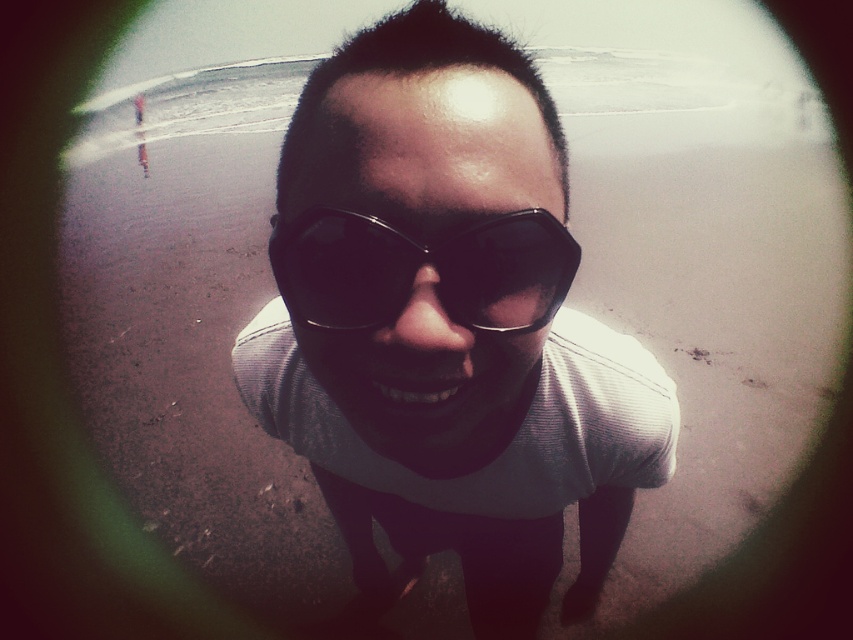
This screenshot has width=853, height=640. Describe the element at coordinates (447, 326) in the screenshot. I see `matte black sunglasses at center` at that location.

In the scene shown: Does matte black sunglasses at center appear on the right side of black plastic goggles at center?

Indeed, matte black sunglasses at center is positioned on the right side of black plastic goggles at center.

Where is `matte black sunglasses at center`? Image resolution: width=853 pixels, height=640 pixels. matte black sunglasses at center is located at coordinates (447, 326).

Locate an element on the screen. matte black sunglasses at center is located at coordinates (447, 326).